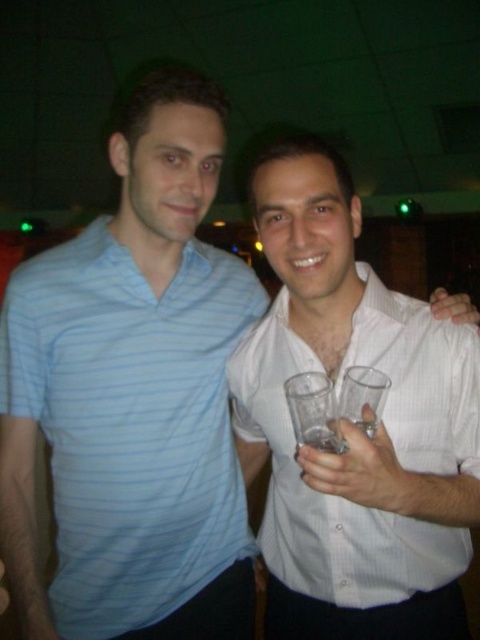
Between clear glass at center and clear plastic glass at center, which one has less height?

clear plastic glass at center

Which is in front, point (349, 490) or point (312, 444)?

Point (349, 490) is in front.

Is point (337, 490) more distant than point (324, 444)?

No, (337, 490) is in front of (324, 444).

I want to click on clear glass at center, so click(x=360, y=472).

Is white textured shirt at center further to the viewer compared to clear plastic glass at center?

No, white textured shirt at center is in front of clear plastic glass at center.

Between point (240, 429) and point (316, 442), which one is positioned in front?

Positioned in front is point (316, 442).

This screenshot has height=640, width=480. Identify the location of white textured shirt at center. (326, 493).

Which is behind, point (375, 458) or point (470, 310)?

The point (470, 310) is more distant.

In order to click on clear glass at center in this screenshot , I will do `click(360, 472)`.